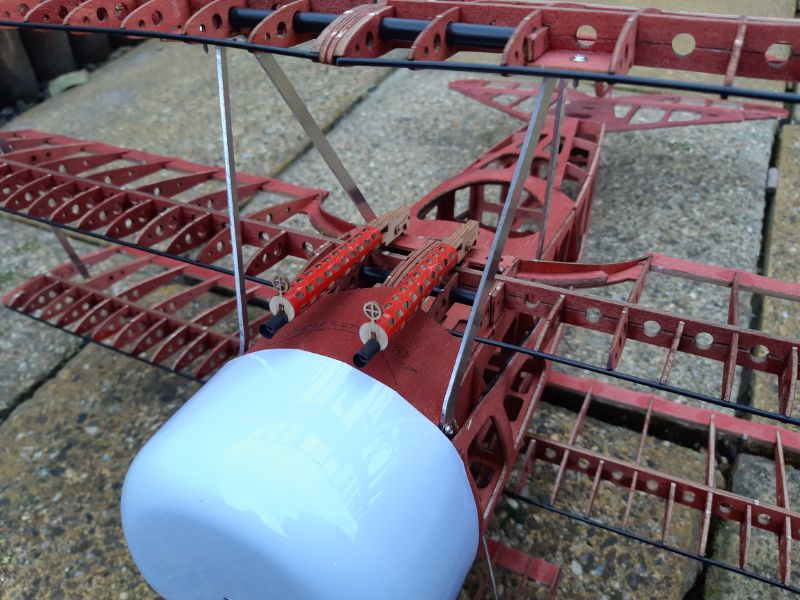
You are a GUI agent. You are given a task and a screenshot of the screen. Output one action in this format:
    pyautogui.click(x=<x>, y=<y>)
    Task: Click on the black cannister
    This screenshot has height=600, width=800.
    Given the screenshot: What is the action you would take?
    pyautogui.click(x=54, y=57)